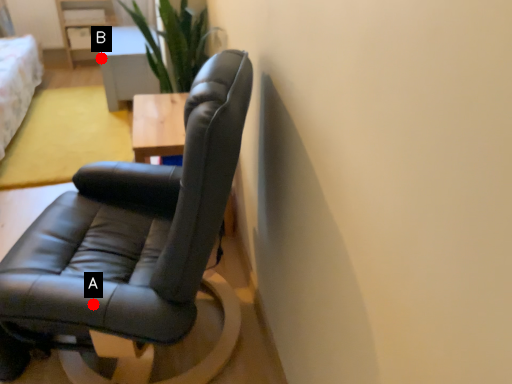
Question: Two points are circled on the image, labeled by A and B beside each circle. Which point is farther from the camera taking this photo?

Choices:
 (A) A is further
 (B) B is further

Answer: (B)